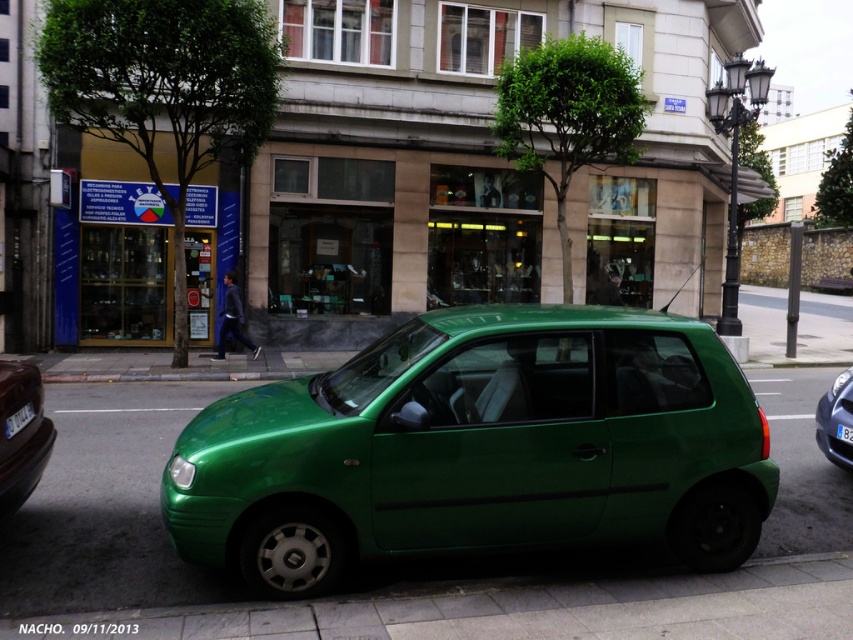
Question: Which point is closer to the camera taking this photo?

Choices:
 (A) (840, 424)
 (B) (556, 385)
 (C) (849, 436)

Answer: (B)

Question: In this image, where is green matte car at center located relative to green matte hatchback at lower left?

Choices:
 (A) above
 (B) below

Answer: (B)

Question: Does green matte car at center appear over green matte hatchback at lower left?

Choices:
 (A) yes
 (B) no

Answer: (B)

Question: Which point is closer to the camera?

Choices:
 (A) (849, 436)
 (B) (13, 403)
 (C) (9, 420)
 (D) (844, 403)

Answer: (C)

Question: Which is farther from the green matte hatchback at right?

Choices:
 (A) black plastic license plate at lower right
 (B) green rubber pavement at center

Answer: (B)

Question: Does green matte car at center appear on the left side of white plastic license plate at lower left?

Choices:
 (A) no
 (B) yes

Answer: (A)